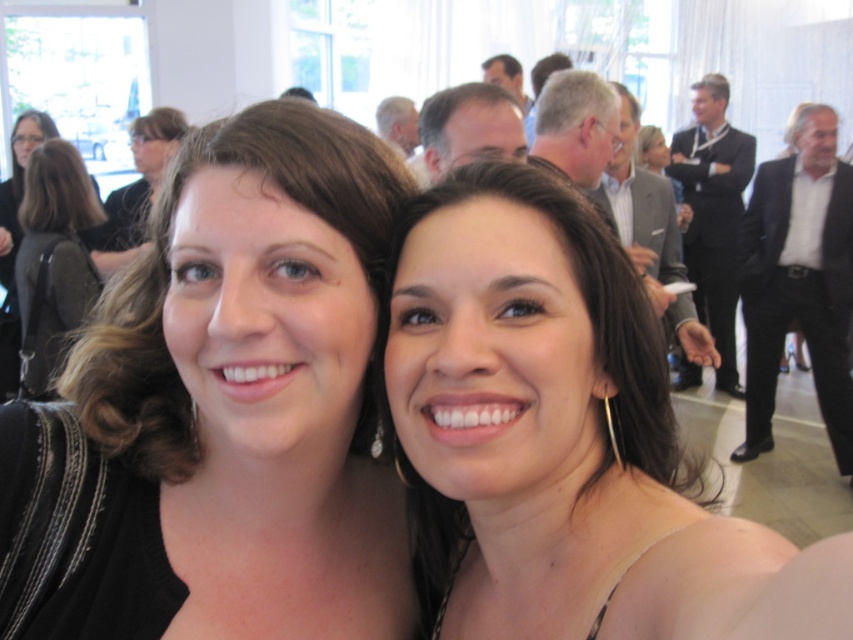
Question: Does black fabric at center appear under black suit at right?

Choices:
 (A) no
 (B) yes

Answer: (B)

Question: Does black fabric at center appear over black leather backpack at left?

Choices:
 (A) yes
 (B) no

Answer: (B)

Question: Is black fabric at center to the left of black suit at right from the viewer's perspective?

Choices:
 (A) yes
 (B) no

Answer: (A)

Question: Which of these objects is positioned farthest from the black suit at right?

Choices:
 (A) black fabric at center
 (B) smooth skin face at center

Answer: (A)

Question: Which object is farther from the camera taking this photo?

Choices:
 (A) smooth skin face at center
 (B) black fabric at center

Answer: (B)

Question: Based on their relative distances, which object is farther from the black fabric at center?

Choices:
 (A) black suit at right
 (B) black leather backpack at left
 (C) smooth skin face at center

Answer: (A)